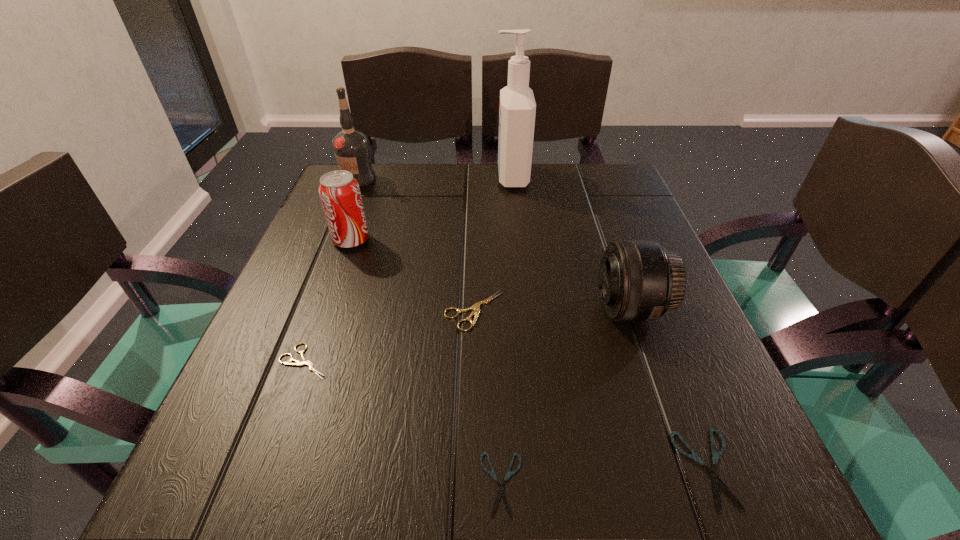
Where is `the bigger black shears`? The width and height of the screenshot is (960, 540). the bigger black shears is located at coordinates (716, 480).

Where is `the shortest shears`? The image size is (960, 540). the shortest shears is located at coordinates (500, 493).

Where is `the smaller black shears`? Image resolution: width=960 pixels, height=540 pixels. the smaller black shears is located at coordinates (500, 493).

Where is `vacant space located on the front label of the tallest object`? This screenshot has width=960, height=540. vacant space located on the front label of the tallest object is located at coordinates (368, 177).

Where is `blank space located on the front label of the tallest object`? The width and height of the screenshot is (960, 540). blank space located on the front label of the tallest object is located at coordinates (406, 177).

Where is `vacant area situated 0.270m on the front label of the tallest object`? This screenshot has height=540, width=960. vacant area situated 0.270m on the front label of the tallest object is located at coordinates (391, 177).

Identify the location of vacant space located 0.140m on the front label of the vodka. (342, 220).

Find the location of `vacant space situated 0.170m on the logo side of the soda can`. vacant space situated 0.170m on the logo side of the soda can is located at coordinates (448, 240).

This screenshot has height=540, width=960. Find the location of `vacant region located on the front-facing side of the telephoto lens`. vacant region located on the front-facing side of the telephoto lens is located at coordinates (398, 309).

Where is `vacant area situated on the front-facing side of the telephoto lens`? The height and width of the screenshot is (540, 960). vacant area situated on the front-facing side of the telephoto lens is located at coordinates (481, 309).